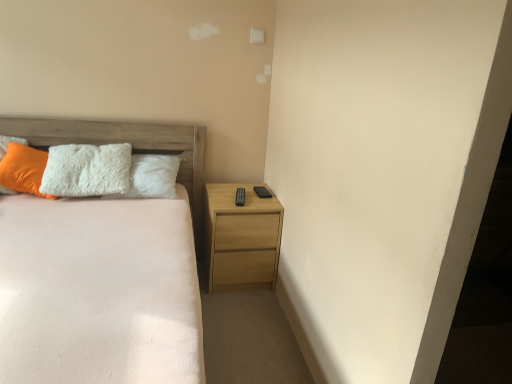
Question: Is orange fuzzy pillow at left situated inside white fluffy bed at center or outside?

Choices:
 (A) outside
 (B) inside

Answer: (B)

Question: Based on their positions, is orange fuzzy pillow at left located to the left or right of white fluffy bed at center?

Choices:
 (A) left
 (B) right

Answer: (A)

Question: Which is nearer to the orange fuzzy pillow at left?

Choices:
 (A) white fluffy bed at center
 (B) wooden headboard at upper left
 (C) light wood/texture nightstand at right

Answer: (B)

Question: Estimate the real-world distances between objects in this image. Which object is closer to the orange fuzzy pillow at left?

Choices:
 (A) light wood/texture nightstand at right
 (B) wooden headboard at upper left
 (C) white fluffy bed at center

Answer: (B)